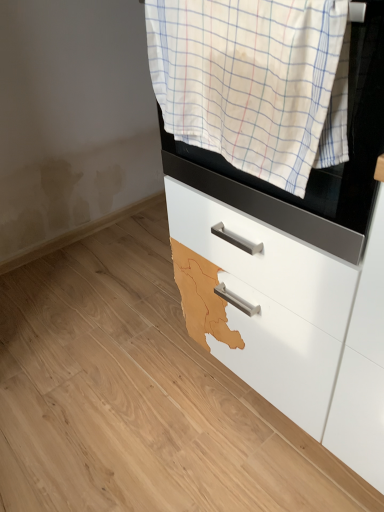
Question: From a real-world perspective, is white checkered towel at upper center above or below white glossy drawer at center?

Choices:
 (A) above
 (B) below

Answer: (A)

Question: Considering their positions, is white checkered towel at upper center located in front of or behind white glossy drawer at center?

Choices:
 (A) behind
 (B) front

Answer: (B)

Question: From the image's perspective, is white checkered towel at upper center above or below white glossy drawer at center?

Choices:
 (A) above
 (B) below

Answer: (A)

Question: Is point (206, 300) closer or farther from the camera than point (236, 15)?

Choices:
 (A) farther
 (B) closer

Answer: (A)

Question: In the image, is white glossy drawer at center on the left side or the right side of white checkered towel at upper center?

Choices:
 (A) right
 (B) left

Answer: (A)

Question: Is white glossy drawer at center situated inside white checkered towel at upper center or outside?

Choices:
 (A) outside
 (B) inside

Answer: (A)

Question: Is white glossy drawer at center wider or thinner than white checkered towel at upper center?

Choices:
 (A) thin
 (B) wide

Answer: (B)